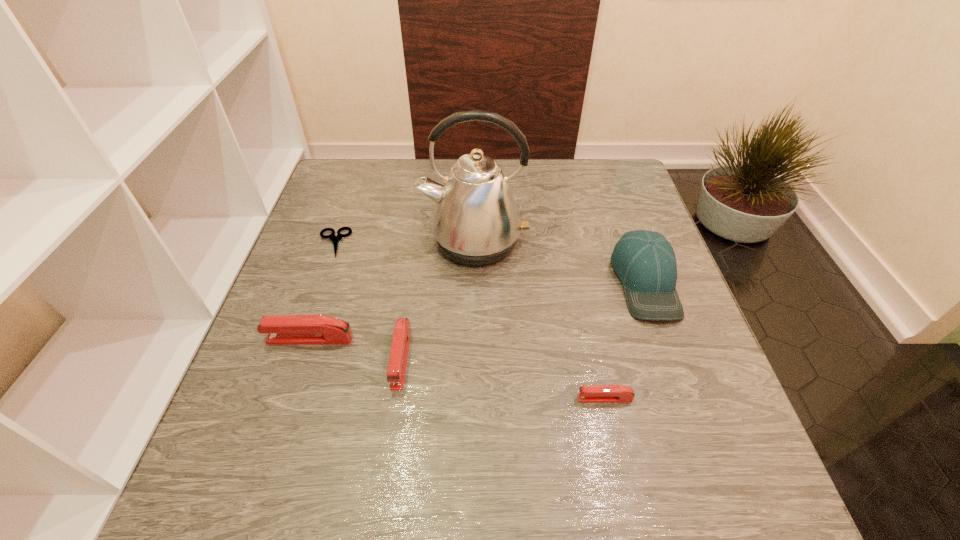
If we want them evenly spaced by inserting an extra stapler_(stapling_machine) among them, please locate a free spot for this new stapler_(stapling_machine). Please provide its 2D coordinates. Your answer should be formatted as a tuple, i.e. [(x, y)], where the tuple contains the x and y coordinates of a point satisfying the conditions above.

[(499, 377)]